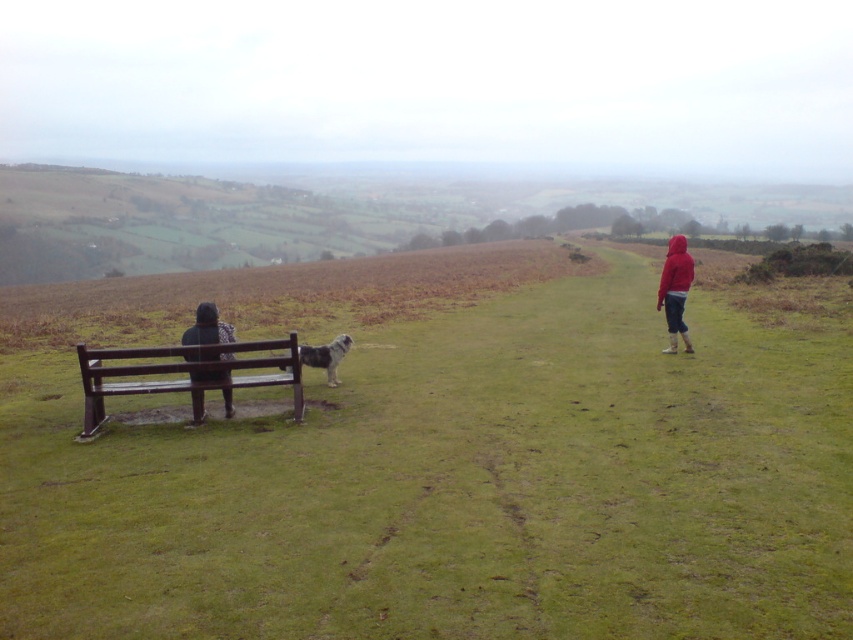
You are a photographer trying to capture both the red fleece jacket at right and the dark textured jacket at left in the same frame. Based on their positions, which jacket will appear smaller in the photo?

The dark textured jacket at left will appear smaller in the photo because it is farther away from the camera compared to the red fleece jacket at right.

You are standing on the path and see the brown wooden bench at left and the white fluffy dog at center. Which object is closer to your right side?

The white fluffy dog at center is closer to your right side because the bench is to the left of the dog.